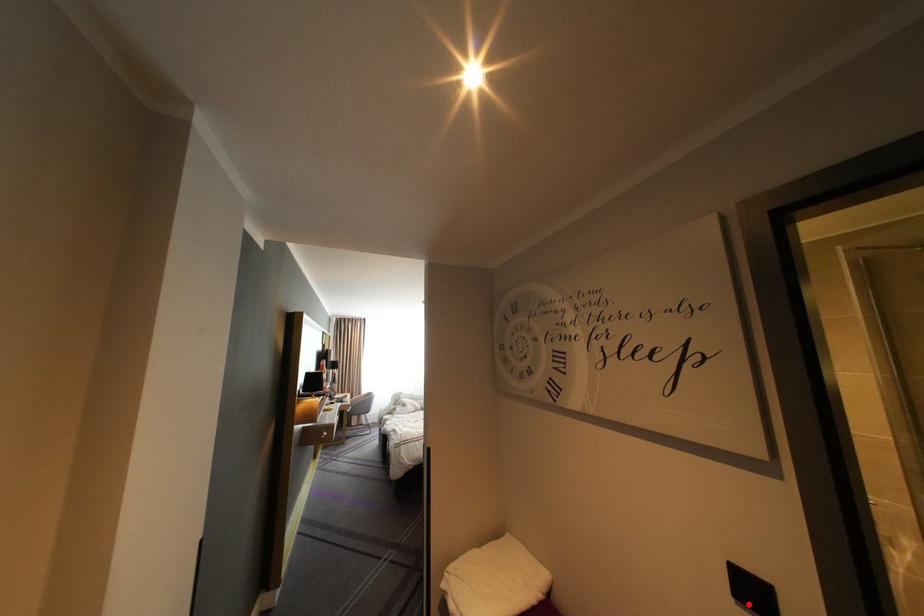
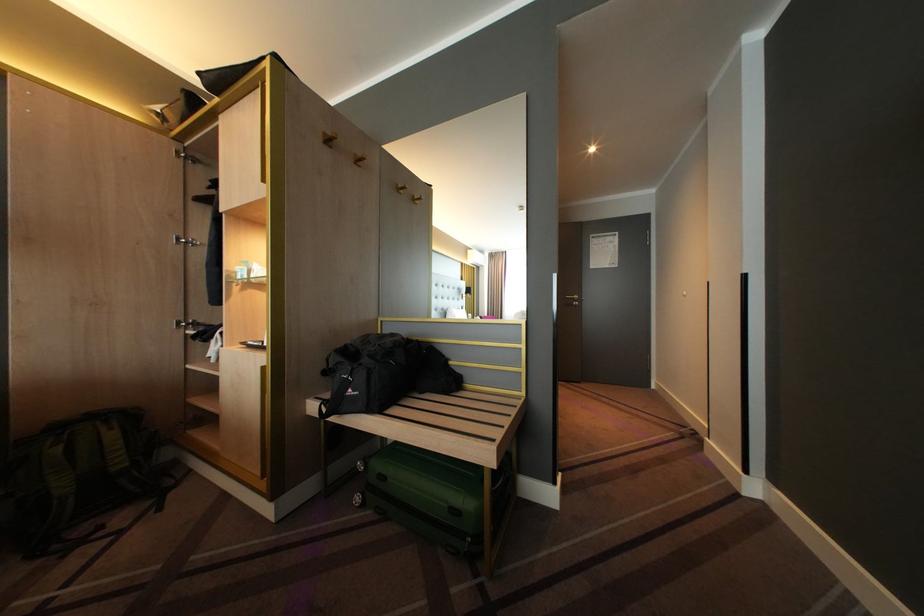
Question: I am providing you with two images of the same scene from different viewpoints. A red point is marked on the first image. Is the red point's position out of view in image 2?

Choices:
 (A) Yes
 (B) No

Answer: (A)